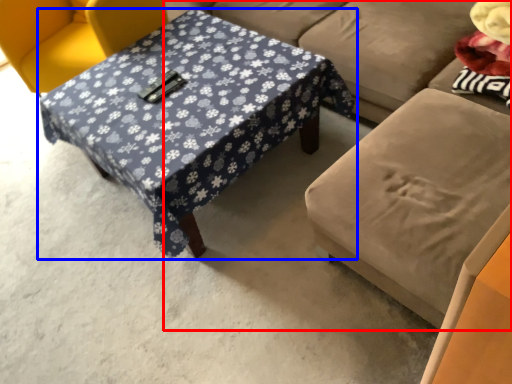
Question: Which object appears closest to the camera in this image, studio couch (highlighted by a red box) or table (highlighted by a blue box)?

Choices:
 (A) studio couch
 (B) table

Answer: (A)